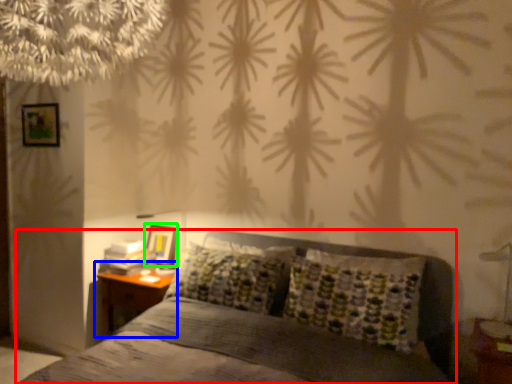
Question: Based on their relative distances, which object is farther from bed (highlighted by a red box)? Choose from nightstand (highlighted by a blue box) and picture frame (highlighted by a green box).

Choices:
 (A) nightstand
 (B) picture frame

Answer: (B)